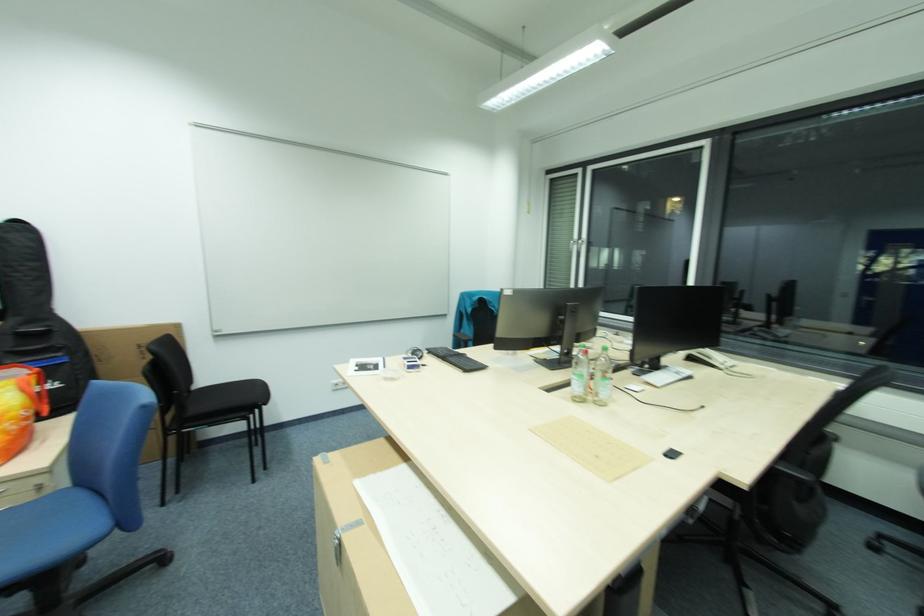
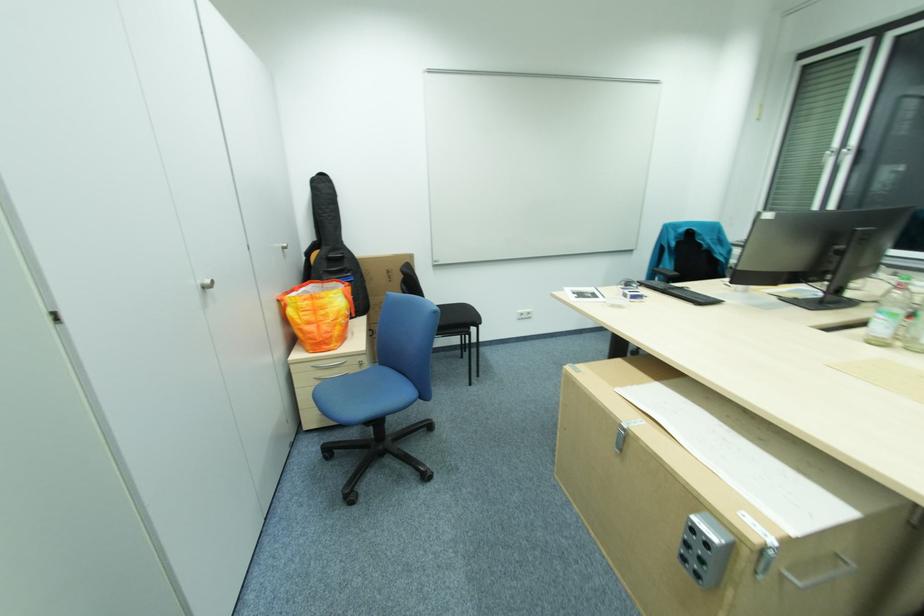
Question: The first image is from the beginning of the video and the second image is from the end. How did the camera likely rotate when shooting the video?

Choices:
 (A) Left
 (B) Right
 (C) Up
 (D) Down

Answer: (A)